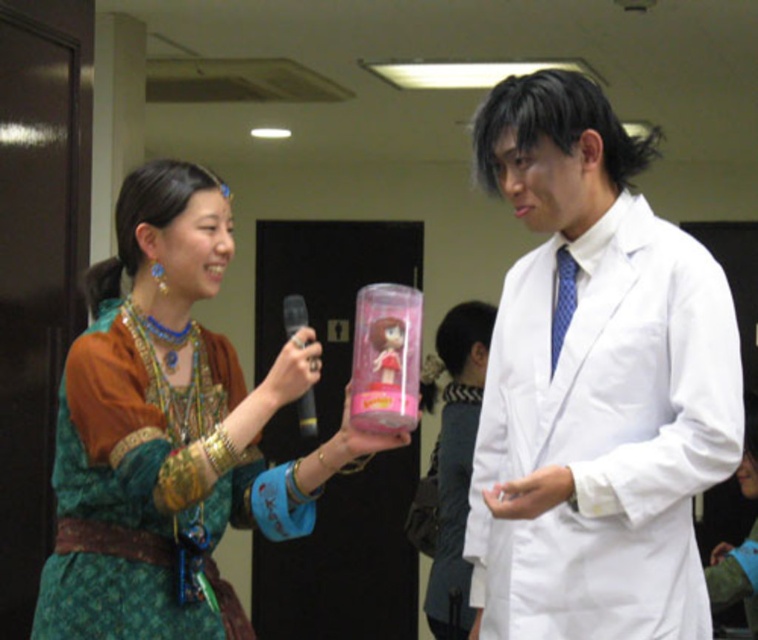
Question: Does denim at right appear on the left side of green velvet dress at lower right?

Choices:
 (A) yes
 (B) no

Answer: (A)

Question: Which of the following is the closest to the observer?

Choices:
 (A) denim at right
 (B) green velvet dress at lower right
 (C) white smooth lab coat at right

Answer: (C)

Question: Can you confirm if white smooth lab coat at right is positioned below denim at right?

Choices:
 (A) yes
 (B) no

Answer: (B)

Question: Does matte green dress at center appear on the right side of denim at right?

Choices:
 (A) no
 (B) yes

Answer: (A)

Question: Estimate the real-world distances between objects in this image. Which object is farther from the matte green dress at center?

Choices:
 (A) denim at right
 (B) white smooth lab coat at right

Answer: (A)

Question: Which object is farther from the camera taking this photo?

Choices:
 (A) white smooth lab coat at right
 (B) denim at right
 (C) green velvet dress at lower right
 (D) matte green dress at center

Answer: (B)